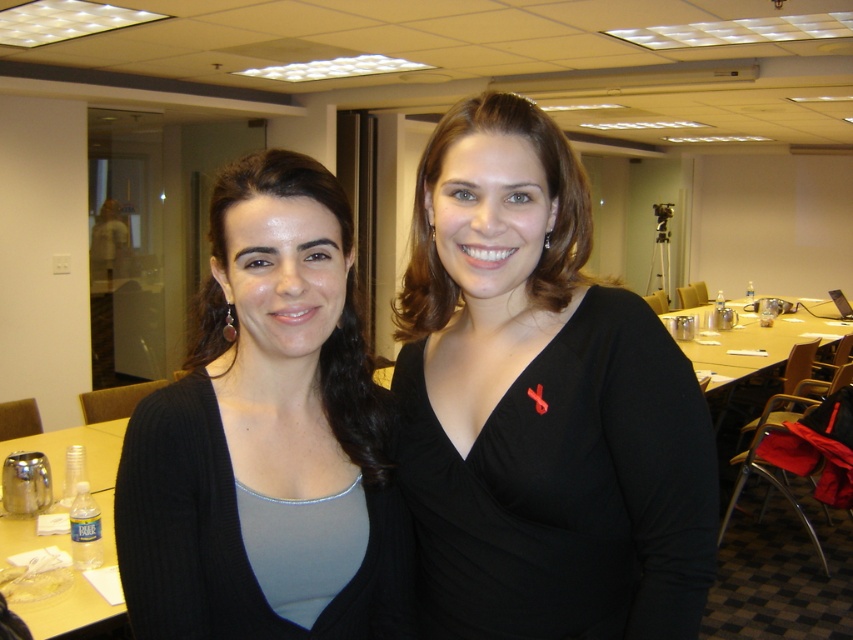
Question: Can you confirm if clear plastic water bottle at lower left is thinner than wooden table at center?

Choices:
 (A) yes
 (B) no

Answer: (A)

Question: Does clear plastic water bottle at lower left have a greater width compared to wooden table at center?

Choices:
 (A) no
 (B) yes

Answer: (A)

Question: Does black matte dress at center appear on the left side of matte black cardigan at center?

Choices:
 (A) yes
 (B) no

Answer: (B)

Question: Which point is closer to the camera?

Choices:
 (A) matte black cardigan at center
 (B) clear plastic water bottle at lower left
 (C) black matte dress at center
 (D) wooden table at center

Answer: (A)

Question: Among these objects, which one is nearest to the camera?

Choices:
 (A) black matte dress at center
 (B) matte black cardigan at center
 (C) wooden table at center
 (D) clear plastic water bottle at lower left

Answer: (B)

Question: Which object appears farthest from the camera in this image?

Choices:
 (A) wooden table at center
 (B) matte black cardigan at center
 (C) clear plastic water bottle at lower left
 (D) black matte dress at center

Answer: (A)